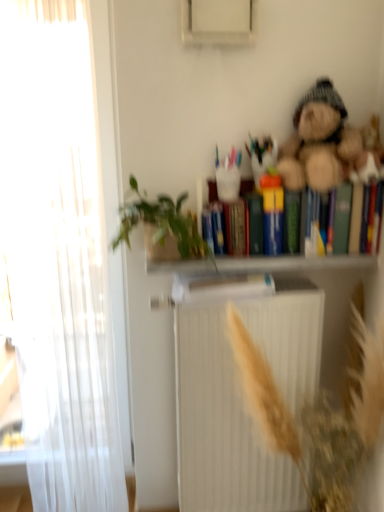
Where is `multicolored hardcover books at upper right`? The width and height of the screenshot is (384, 512). multicolored hardcover books at upper right is located at coordinates (353, 214).

I want to click on white matte radiator at center, so click(221, 425).

In order to face green leafy plant at upper center, should I rotate leftwards or rightwards?

Rotate left and turn 3.955 degrees.

Find the location of a particular element. white matte bookcase at upper center is located at coordinates (152, 378).

From a real-world perspective, which object stands above the other?

green leafy plant at upper center.

This screenshot has height=512, width=384. In order to click on bookcase in front of the green leafy plant at upper center in this screenshot , I will do `click(152, 378)`.

Would you say green leafy plant at upper center is inside or outside white matte bookcase at upper center?

green leafy plant at upper center is spatially situated outside white matte bookcase at upper center.

Does green leafy plant at upper center have a larger size compared to white matte bookcase at upper center?

No, green leafy plant at upper center is not bigger than white matte bookcase at upper center.

Is point (144, 308) positioned after point (250, 304)?

Yes, it is.

Is white matte bookcase at upper center looking in the opposite direction of white matte radiator at center?

white matte bookcase at upper center does not have its back to white matte radiator at center.

Based on the photo, would you consider white matte bookcase at upper center to be distant from white matte radiator at center?

No.

Between white matte bookcase at upper center and white matte radiator at center, which one appears on the right side from the viewer's perspective?

Positioned to the right is white matte bookcase at upper center.

Can you confirm if multicolored hardcover books at upper right is smaller than white matte radiator at center?

Correct, multicolored hardcover books at upper right occupies less space than white matte radiator at center.

Is multicolored hardcover books at upper right taller than white matte radiator at center?

No.

Is point (338, 228) positioned in front of point (313, 395)?

Yes.

Can you confirm if multicolored hardcover books at upper right is positioned to the left of white matte radiator at center?

Incorrect, multicolored hardcover books at upper right is not on the left side of white matte radiator at center.

Between point (365, 239) and point (201, 251), which one is positioned in front?

The point (201, 251) is more forward.

Could you tell me if multicolored hardcover books at upper right is facing green leafy plant at upper center?

No, multicolored hardcover books at upper right is not facing towards green leafy plant at upper center.

Is multicolored hardcover books at upper right located outside green leafy plant at upper center?

multicolored hardcover books at upper right lies outside green leafy plant at upper center's area.

From the image's perspective, is multicolored hardcover books at upper right beneath green leafy plant at upper center?

No, from the image's perspective, multicolored hardcover books at upper right is not below green leafy plant at upper center.

Choose the correct answer: Is white sheer curtain at left inside multicolored hardcover books at upper right or outside it?

white sheer curtain at left lies outside multicolored hardcover books at upper right.

From a real-world perspective, is white sheer curtain at left located higher than multicolored hardcover books at upper right?

No.

From the image's perspective, does white sheer curtain at left appear lower than multicolored hardcover books at upper right?

Yes, from the image's perspective, white sheer curtain at left is beneath multicolored hardcover books at upper right.

Considering the relative positions of white sheer curtain at left and multicolored hardcover books at upper right in the image provided, is white sheer curtain at left to the right of multicolored hardcover books at upper right from the viewer's perspective?

Incorrect, white sheer curtain at left is not on the right side of multicolored hardcover books at upper right.

Looking at this image, is white matte radiator at center surrounding fuzzy brown teddy bear at upper right?

No, white matte radiator at center does not contain fuzzy brown teddy bear at upper right.

Considering the relative sizes of white matte radiator at center and fuzzy brown teddy bear at upper right in the image provided, is white matte radiator at center smaller than fuzzy brown teddy bear at upper right?

No, white matte radiator at center is not smaller than fuzzy brown teddy bear at upper right.

Which object is further away from the camera taking this photo, white matte radiator at center or fuzzy brown teddy bear at upper right?

white matte radiator at center is further away from the camera.

Is green leafy plant at upper center placed right next to white matte radiator at center?

green leafy plant at upper center and white matte radiator at center are not in contact.

Is white matte radiator at center inside green leafy plant at upper center?

No, white matte radiator at center is not surrounded by green leafy plant at upper center.

From a real-world perspective, is green leafy plant at upper center over white matte radiator at center?

Correct, in the physical world, green leafy plant at upper center is higher than white matte radiator at center.

In the image, there is a green leafy plant at upper center. Where is `radiator below it (from a real-world perspective)`? This screenshot has height=512, width=384. radiator below it (from a real-world perspective) is located at coordinates (221, 425).

Identify the location of bookcase in front of the green leafy plant at upper center. The height and width of the screenshot is (512, 384). (152, 378).

Identify the location of bookcase above the white matte radiator at center (from the image's perspective). The width and height of the screenshot is (384, 512). (152, 378).

Estimate the real-world distances between objects in this image. Which object is closer to white sheer curtain at left, white matte bookcase at upper center or multicolored hardcover books at upper right?

white matte bookcase at upper center is positioned closer to the anchor white sheer curtain at left.

When comparing their distances from white matte bookcase at upper center, does white sheer curtain at left or green leafy plant at upper center seem closer?

Among the two, green leafy plant at upper center is located nearer to white matte bookcase at upper center.

Estimate the real-world distances between objects in this image. Which object is further from white matte bookcase at upper center, fuzzy brown teddy bear at upper right or white sheer curtain at left?

fuzzy brown teddy bear at upper right is positioned further to the anchor white matte bookcase at upper center.

Which object lies further to the anchor point fuzzy brown teddy bear at upper right, white matte bookcase at upper center or white matte radiator at center?

Based on the image, white matte radiator at center appears to be further to fuzzy brown teddy bear at upper right.

Which object lies nearer to the anchor point white matte radiator at center, fuzzy brown teddy bear at upper right or white matte bookcase at upper center?

Based on the image, white matte bookcase at upper center appears to be nearer to white matte radiator at center.

Based on their spatial positions, is white sheer curtain at left or multicolored hardcover books at upper right further from white matte radiator at center?

multicolored hardcover books at upper right is positioned further to the anchor white matte radiator at center.

Estimate the real-world distances between objects in this image. Which object is further from white matte radiator at center, multicolored hardcover books at upper right or green leafy plant at upper center?

multicolored hardcover books at upper right is further to white matte radiator at center.

When comparing their distances from white matte radiator at center, does white matte bookcase at upper center or multicolored hardcover books at upper right seem further?

multicolored hardcover books at upper right.

Image resolution: width=384 pixels, height=512 pixels. Identify the location of curtain between fuzzy brown teddy bear at upper right and white matte bookcase at upper center from top to bottom. (57, 258).

Find the location of a particular element. Image resolution: width=384 pixels, height=512 pixels. radiator between white sheer curtain at left and multicolored hardcover books at upper right from left to right is located at coordinates (221, 425).

Identify the location of bookcase between fuzzy brown teddy bear at upper right and white matte radiator at center in the up-down direction. (152, 378).

Where is `houseplant that lies between multicolored hardcover books at upper right and white matte bookcase at upper center from top to bottom`? This screenshot has width=384, height=512. houseplant that lies between multicolored hardcover books at upper right and white matte bookcase at upper center from top to bottom is located at coordinates (164, 225).